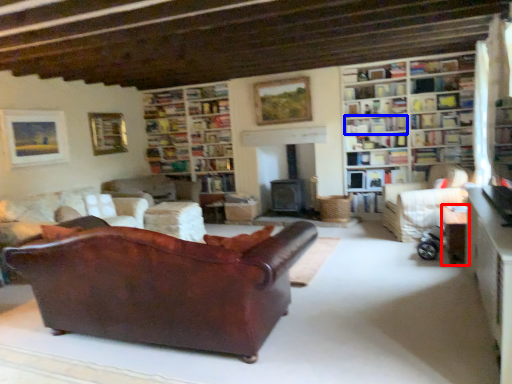
Question: Which of the following is the closest to the observer, table (highlighted by a red box) or book (highlighted by a blue box)?

Choices:
 (A) table
 (B) book

Answer: (A)